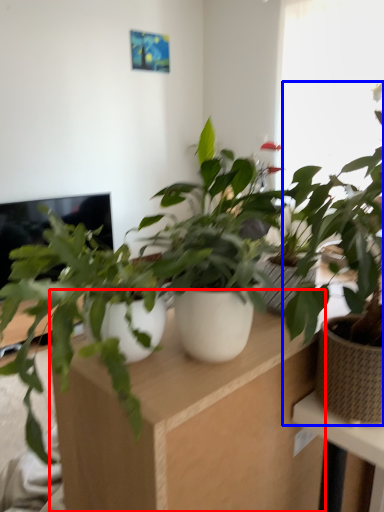
Question: Which point is further to the camera, computer desk (highlighted by a red box) or houseplant (highlighted by a blue box)?

Choices:
 (A) computer desk
 (B) houseplant

Answer: (B)